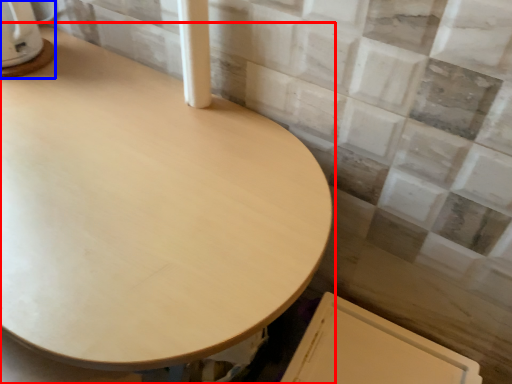
Question: Which point is further to the camera, table (highlighted by a red box) or appliance (highlighted by a blue box)?

Choices:
 (A) table
 (B) appliance

Answer: (B)